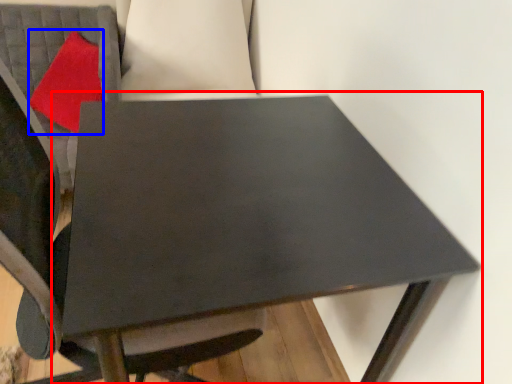
Question: Among these objects, which one is farthest to the camera, table (highlighted by a red box) or pillow (highlighted by a blue box)?

Choices:
 (A) table
 (B) pillow

Answer: (B)